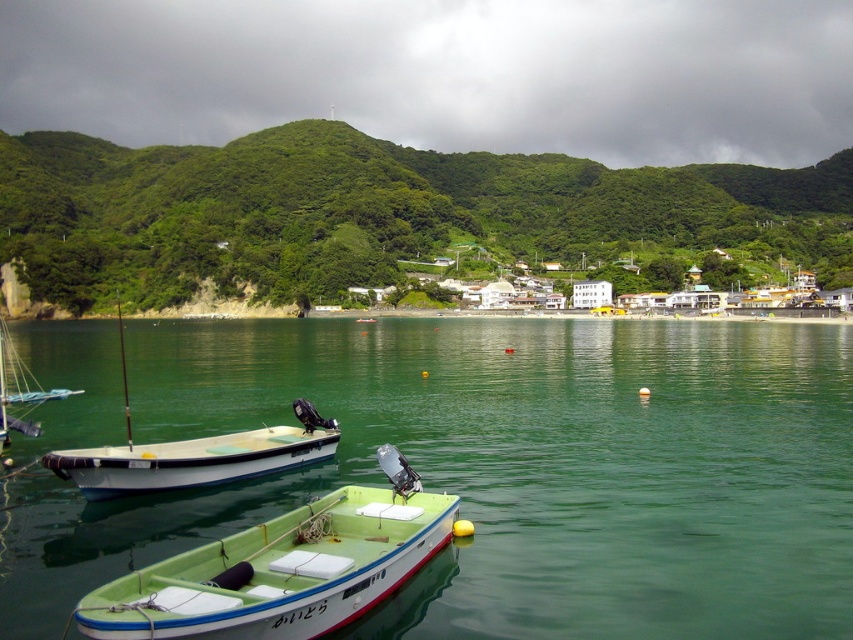
You are a photographer planning to take a landscape shot of the green leafy hillside at center and the white matte boat at center. Which object will appear larger in the photo due to its size and distance?

The green leafy hillside at center will appear larger in the photo because it has a greater height compared to the white matte boat at center.

From the picture: You are standing on the dock and want to throw a lifebuoy to a person in the water. There are two points marked in the image where you think they might be. Which point is closer to you so you can aim better? The points are point (212, 584) and point (135, 467).

Point (212, 584) is closer to the camera than point (135, 467), so you should aim for point (212, 584) as it is nearer to your position on the dock.